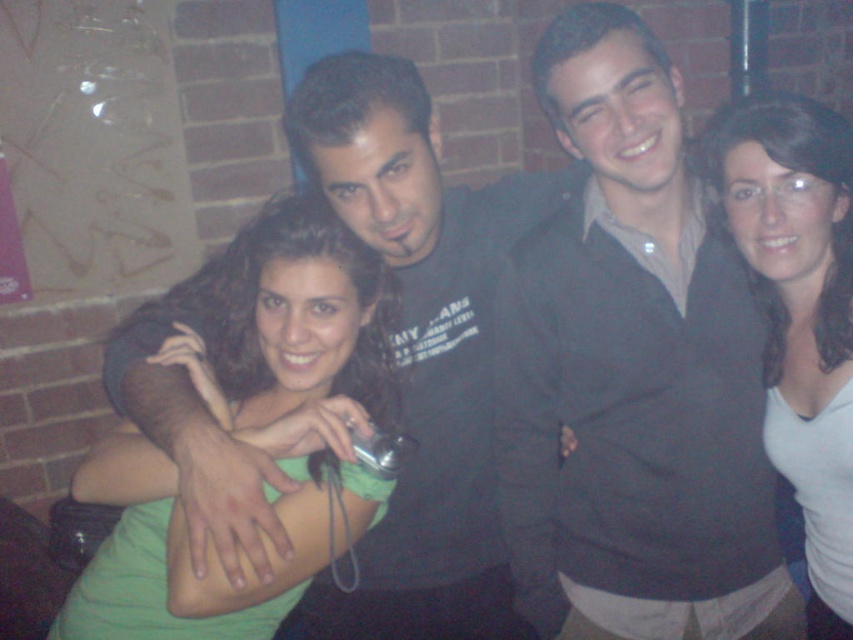
Question: Is dark gray sweater at center below matte black hoodie at center?

Choices:
 (A) yes
 (B) no

Answer: (B)

Question: Which object appears closest to the camera in this image?

Choices:
 (A) dark gray sweater at center
 (B) white matte shirt at right
 (C) green matte shirt at center

Answer: (C)

Question: Among these points, which one is nearest to the camera?

Choices:
 (A) (549, 301)
 (B) (341, 419)
 (C) (460, 355)

Answer: (B)

Question: Which is nearer to the green matte shirt at center?

Choices:
 (A) white matte shirt at right
 (B) dark gray sweater at center
 (C) matte black hoodie at center

Answer: (C)

Question: Is dark gray sweater at center positioned at the back of white matte shirt at right?

Choices:
 (A) no
 (B) yes

Answer: (A)

Question: Does dark gray sweater at center have a smaller size compared to white matte shirt at right?

Choices:
 (A) yes
 (B) no

Answer: (B)